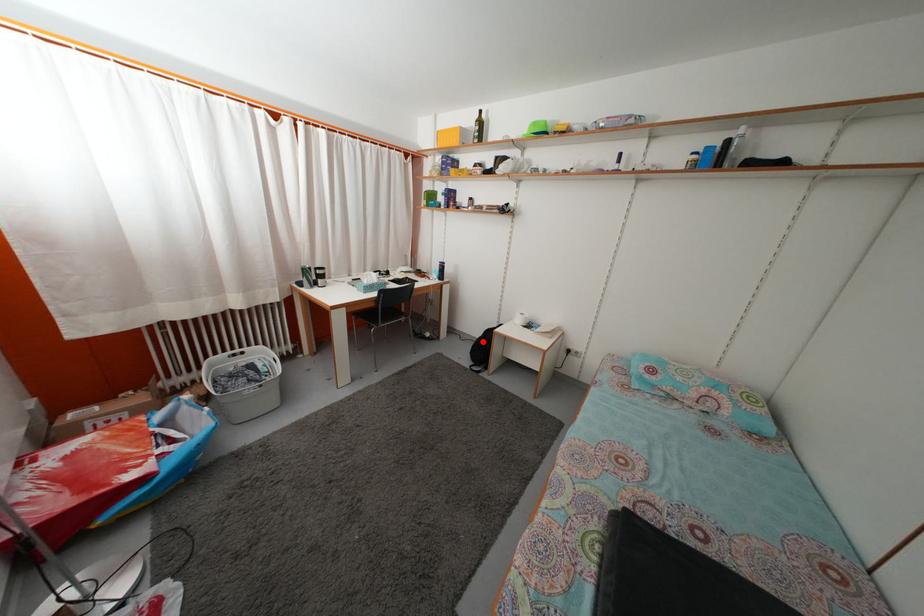
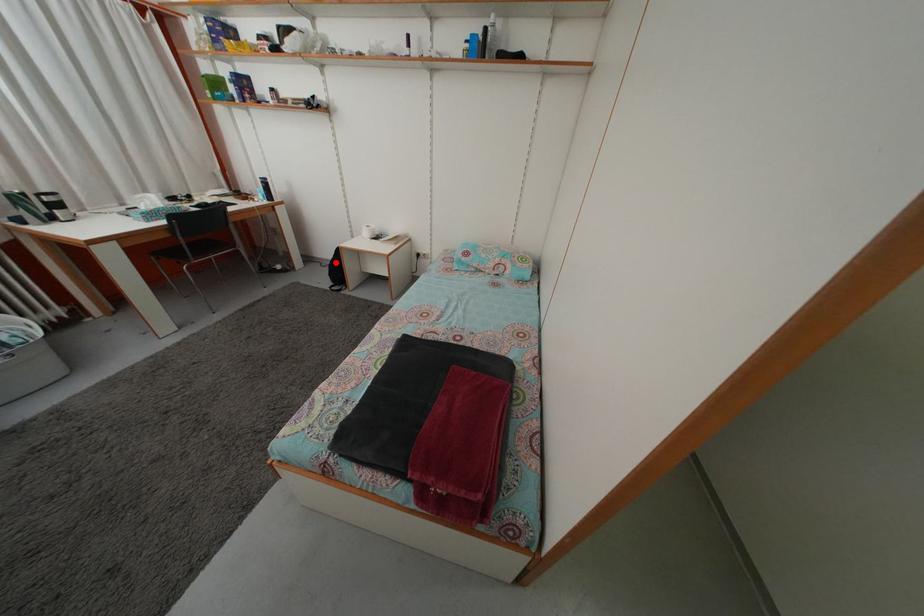
I am providing you with two images of the same scene from different viewpoints. A red point is marked on the first image and another point is marked on the second image. Is the red point in image1 aligned with the point shown in image2?

Yes